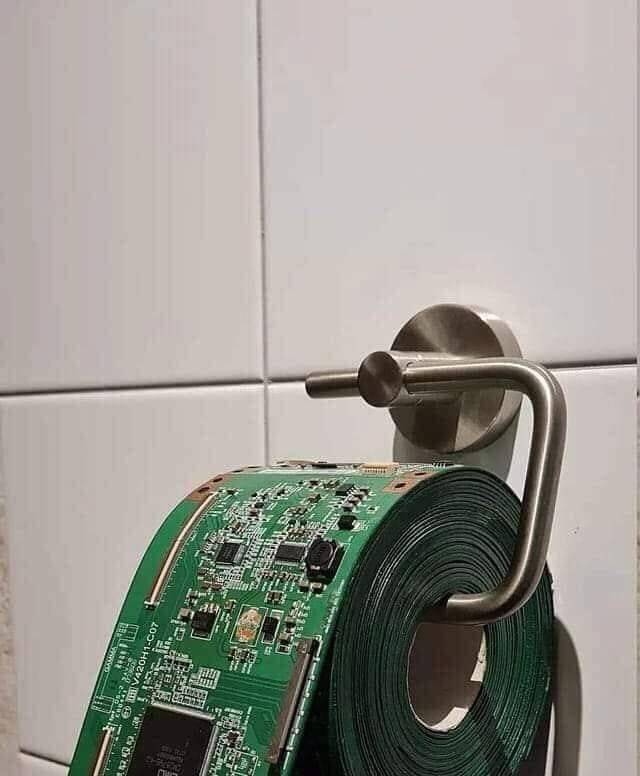
This screenshot has height=776, width=640. I want to click on top right corner of the rounded toilet paper arm, so click(541, 373).